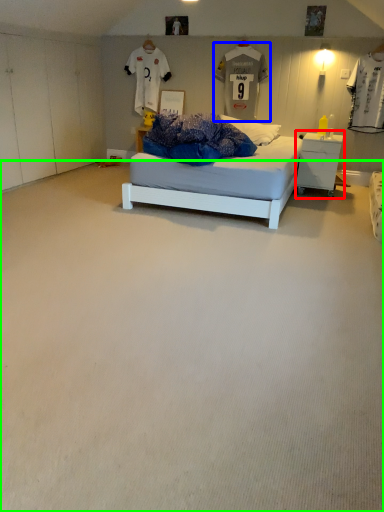
Question: Which object is the closest to the nightstand (highlighted by a red box)? Choose among these: t shirt (highlighted by a blue box) or plain (highlighted by a green box).

Choices:
 (A) t shirt
 (B) plain

Answer: (A)